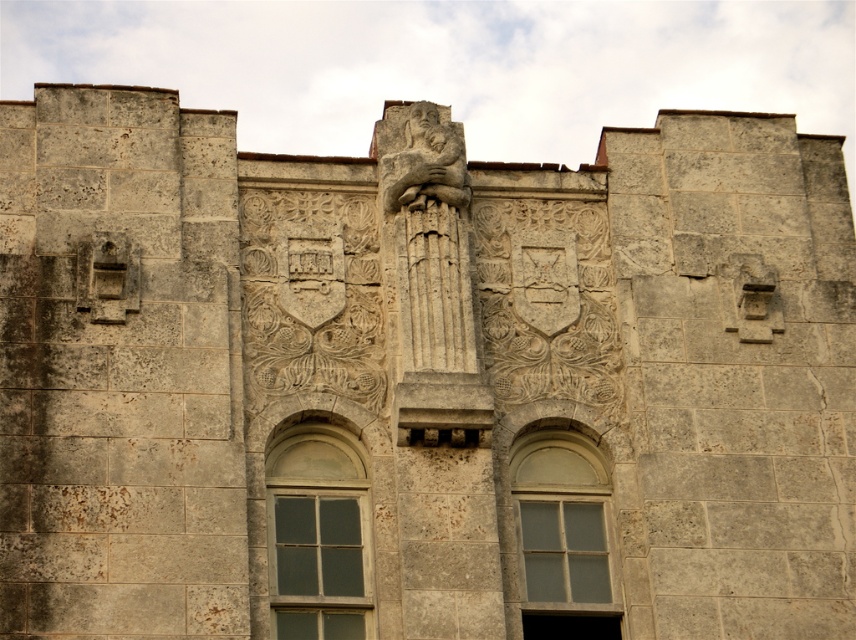
Between matte stone window at center and clear glass window at center, which one has more height?

matte stone window at center

Can you confirm if matte stone window at center is positioned above clear glass window at center?

No, matte stone window at center is not above clear glass window at center.

Does point (266, 467) come farther from viewer compared to point (563, 468)?

That is False.

I want to click on matte stone window at center, so click(x=318, y=534).